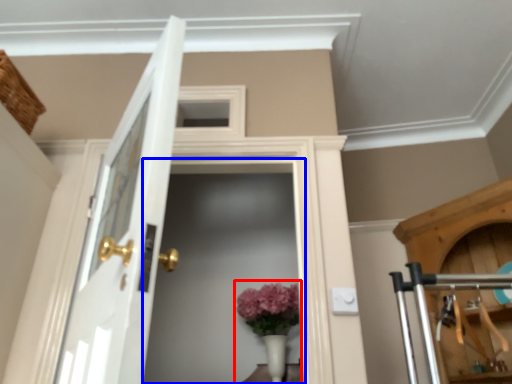
Question: Which of the following is the farthest to the observer, floral arrangement (highlighted by a red box) or screen door (highlighted by a blue box)?

Choices:
 (A) floral arrangement
 (B) screen door

Answer: (A)